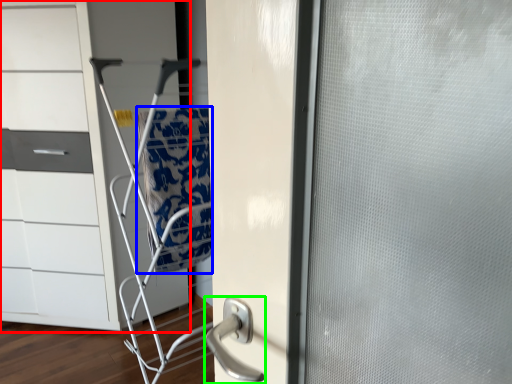
Question: Based on their relative distances, which object is nearer to chest of drawers (highlighted by a red box)? Choose from blanket (highlighted by a blue box) and door handle (highlighted by a green box).

Choices:
 (A) blanket
 (B) door handle

Answer: (A)